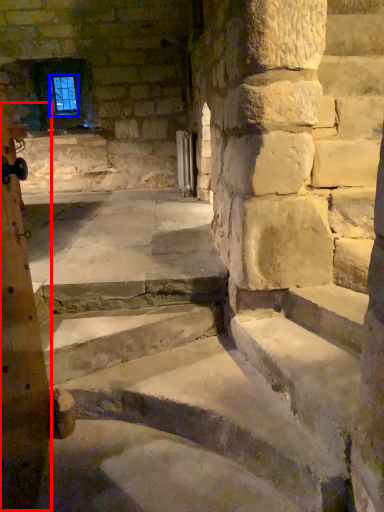
Question: Which object appears farthest to the camera in this image, pillar (highlighted by a red box) or window screen (highlighted by a blue box)?

Choices:
 (A) pillar
 (B) window screen

Answer: (B)